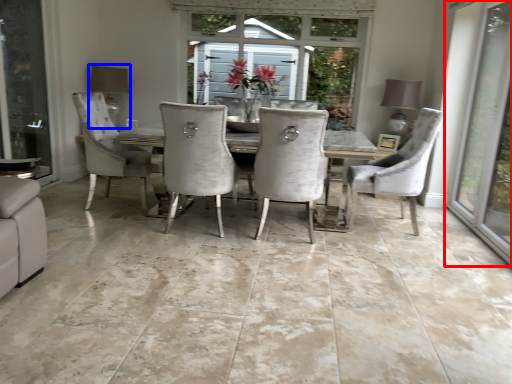
Question: Which of the following is the farthest to the observer, window (highlighted by a red box) or lamp (highlighted by a blue box)?

Choices:
 (A) window
 (B) lamp

Answer: (B)